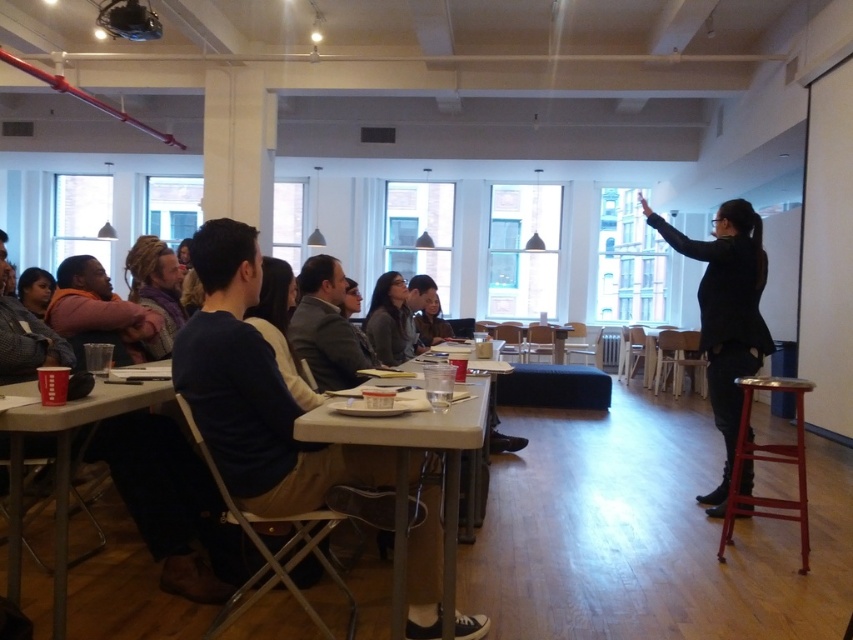
Between white plastic table at center and matte gray sweater at center, which one has less height?

With less height is matte gray sweater at center.

Does point (378, 433) lie behind point (380, 330)?

No, (378, 433) is closer to viewer.

The width and height of the screenshot is (853, 640). In order to click on white plastic table at center in this screenshot , I will do `click(405, 480)`.

Does point (498, 360) come in front of point (283, 308)?

No, it is behind (283, 308).

The width and height of the screenshot is (853, 640). What do you see at coordinates (483, 442) in the screenshot? I see `smooth plastic table at center` at bounding box center [483, 442].

The image size is (853, 640). Describe the element at coordinates (483, 442) in the screenshot. I see `smooth plastic table at center` at that location.

Locate an element on the screen. This screenshot has height=640, width=853. smooth plastic table at center is located at coordinates (483, 442).

Does black leather jacket at upper right have a larger size compared to matte gray sweater at center?

Yes.

Is point (753, 246) more distant than point (395, 346)?

No, it is in front of (395, 346).

The image size is (853, 640). In order to click on black leather jacket at upper right in this screenshot , I will do `click(726, 316)`.